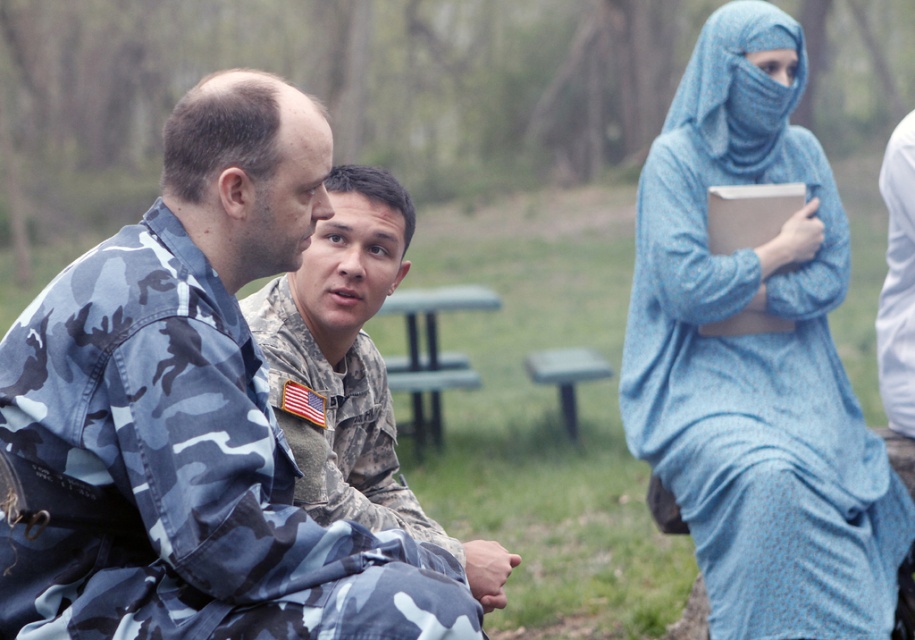
Can you confirm if camouflage uniform at center is bigger than green plastic picnic table at center?

No.

Does camouflage uniform at center have a greater height compared to green plastic picnic table at center?

Indeed, camouflage uniform at center has a greater height compared to green plastic picnic table at center.

The width and height of the screenshot is (915, 640). What do you see at coordinates (352, 371) in the screenshot?
I see `camouflage uniform at center` at bounding box center [352, 371].

In order to click on camouflage uniform at center in this screenshot , I will do `click(352, 371)`.

This screenshot has width=915, height=640. What do you see at coordinates (756, 360) in the screenshot? I see `blue printed dress at right` at bounding box center [756, 360].

Where is `blue printed dress at right`? The image size is (915, 640). blue printed dress at right is located at coordinates (756, 360).

Find the location of `blue printed dress at right`. blue printed dress at right is located at coordinates (756, 360).

Who is more distant from viewer, (60,403) or (334,458)?

Point (334,458)

The width and height of the screenshot is (915, 640). In order to click on camo fabric uniform at left in this screenshot , I will do `click(196, 412)`.